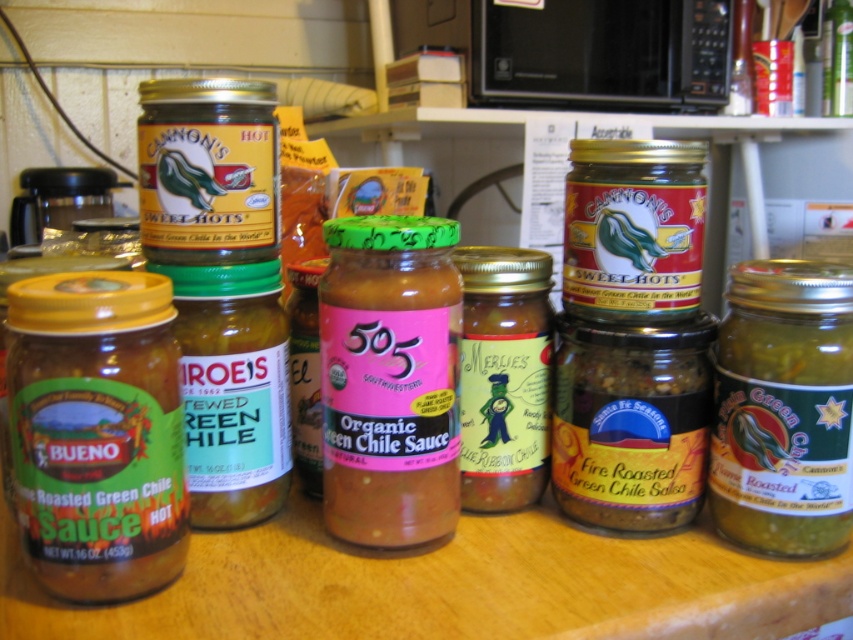
How far apart are green matte glass jar at center and green glass jar at center?

green matte glass jar at center and green glass jar at center are 8.21 inches apart.

Who is shorter, green matte glass jar at center or green glass jar at center?

green matte glass jar at center

Where is `green matte glass jar at center`? green matte glass jar at center is located at coordinates (631, 420).

Locate an element on the screen. green matte glass jar at center is located at coordinates (631, 420).

Which of these two, green glass jar at center or matte glass jar at center, stands shorter?

With less height is green glass jar at center.

Between green glass jar at center and matte glass jar at center, which one is positioned lower?

Positioned lower is green glass jar at center.

Does point (192, 352) come behind point (697, 278)?

No, (192, 352) is in front of (697, 278).

Image resolution: width=853 pixels, height=640 pixels. Find the location of `green glass jar at center`. green glass jar at center is located at coordinates (231, 388).

Is green glass jar at right smaller than matte glass jar at center?

Indeed, green glass jar at right has a smaller size compared to matte glass jar at center.

From the picture: Is green glass jar at right positioned before matte glass jar at center?

Yes, green glass jar at right is closer to the viewer.

Is point (770, 280) positioned before point (641, 170)?

Yes, it is.

Locate an element on the screen. This screenshot has height=640, width=853. green glass jar at right is located at coordinates (784, 406).